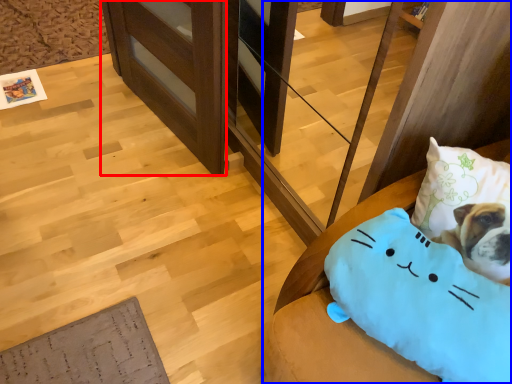
Question: Which object is further to the camera taking this photo, shelf (highlighted by a red box) or furniture (highlighted by a blue box)?

Choices:
 (A) shelf
 (B) furniture

Answer: (A)